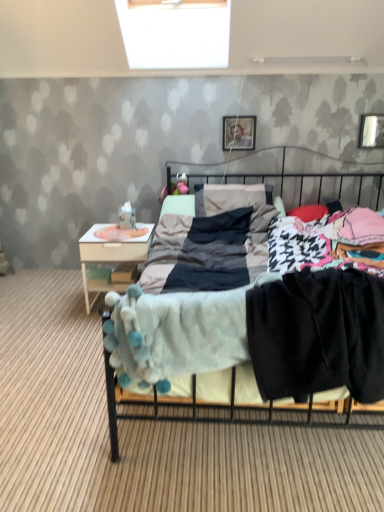
The image size is (384, 512). In order to click on free point in front of white wood nightstand at left in this screenshot , I will do `click(82, 329)`.